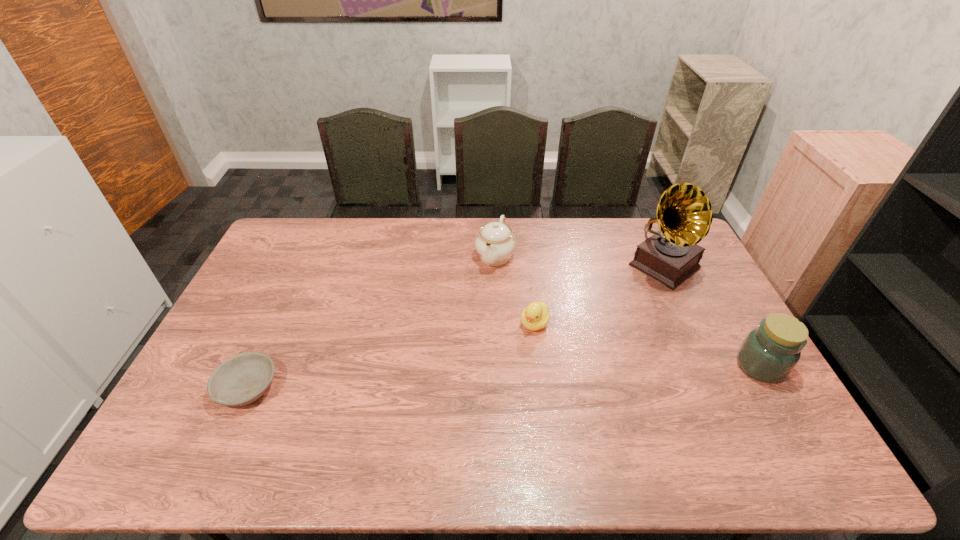
At what (x,y) coordinates should I click in order to perform the action: click on free space at the far left corner of the desktop. Please return your answer as a coordinate pair (x, y). The image size is (960, 540). Looking at the image, I should click on (309, 240).

Identify the location of free spot between the third nearest object and the chinaware. (515, 289).

At what (x,y) coordinates should I click in order to perform the action: click on vacant area between the bowl and the jar. Please return your answer as a coordinate pair (x, y). This screenshot has height=540, width=960. Looking at the image, I should click on (504, 377).

The image size is (960, 540). What are the coordinates of `empty space between the duckling and the tallest object` in the screenshot? It's located at (599, 295).

The image size is (960, 540). Identify the location of blank region between the bowl and the tallest object. (456, 327).

Find the location of a particular element. free area in between the duckling and the phonograph record is located at coordinates (599, 295).

Locate an element on the screen. The width and height of the screenshot is (960, 540). free spot between the leftmost object and the phonograph record is located at coordinates (456, 327).

The width and height of the screenshot is (960, 540). Find the location of `free space between the chinaware and the bowl`. free space between the chinaware and the bowl is located at coordinates (372, 322).

This screenshot has height=540, width=960. I want to click on blank region between the chinaware and the jar, so click(x=628, y=311).

Image resolution: width=960 pixels, height=540 pixels. Identify the location of vacant point located between the jar and the phonograph record. (712, 316).